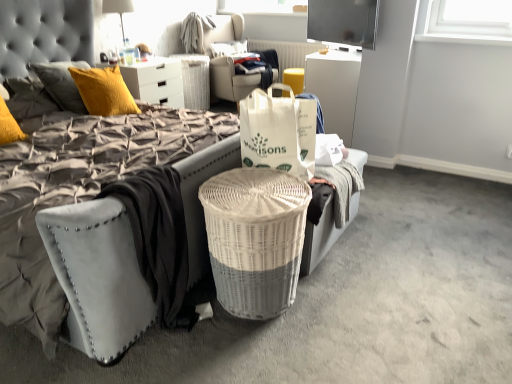
At what (x,y) coordinates should I click in order to perform the action: click on vacant space to the right of white wicker picnic basket at center. Please return your answer as a coordinate pair (x, y). This screenshot has width=512, height=384. Looking at the image, I should click on (349, 304).